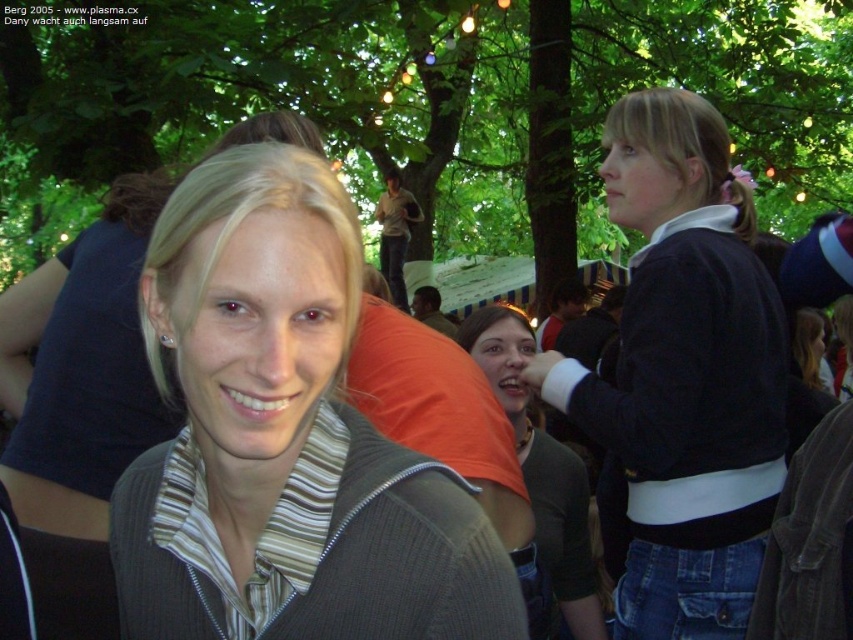
Question: In this image, where is dark blue sweater at right located relative to matte black sweater at center?

Choices:
 (A) left
 (B) right

Answer: (B)

Question: Which object appears farthest from the camera in this image?

Choices:
 (A) dark blue sweater at right
 (B) matte gray sweater at center

Answer: (A)

Question: Which of the following is the closest to the observer?

Choices:
 (A) (549, 538)
 (B) (653, 628)
 (C) (474, 605)

Answer: (C)

Question: Considering the relative positions of matte gray sweater at center and matte black sweater at center in the image provided, where is matte gray sweater at center located with respect to matte black sweater at center?

Choices:
 (A) right
 (B) left

Answer: (B)

Question: Where is matte gray sweater at center located in relation to matte black sweater at center in the image?

Choices:
 (A) right
 (B) left

Answer: (B)

Question: Estimate the real-world distances between objects in this image. Which object is farther from the dark blue sweater at right?

Choices:
 (A) matte black sweater at center
 (B) matte gray sweater at center

Answer: (B)